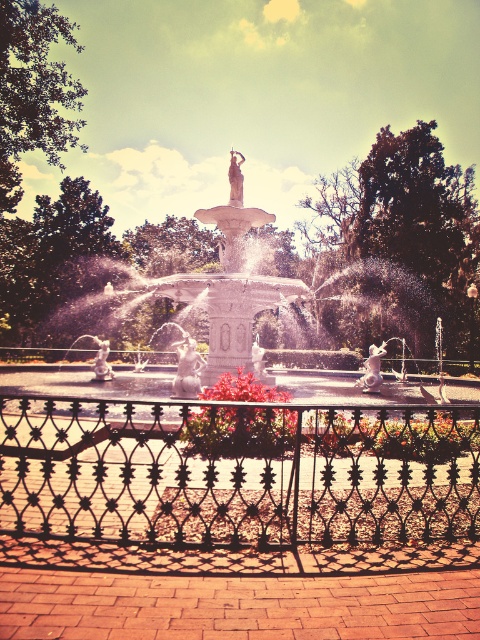
Who is lower down, black wrought iron fence at center or vivid red petals at center?

black wrought iron fence at center is lower down.

At what (x,y) coordinates should I click in order to perform the action: click on black wrought iron fence at center. Please return your answer as a coordinate pair (x, y). The image size is (480, 640). Looking at the image, I should click on (238, 472).